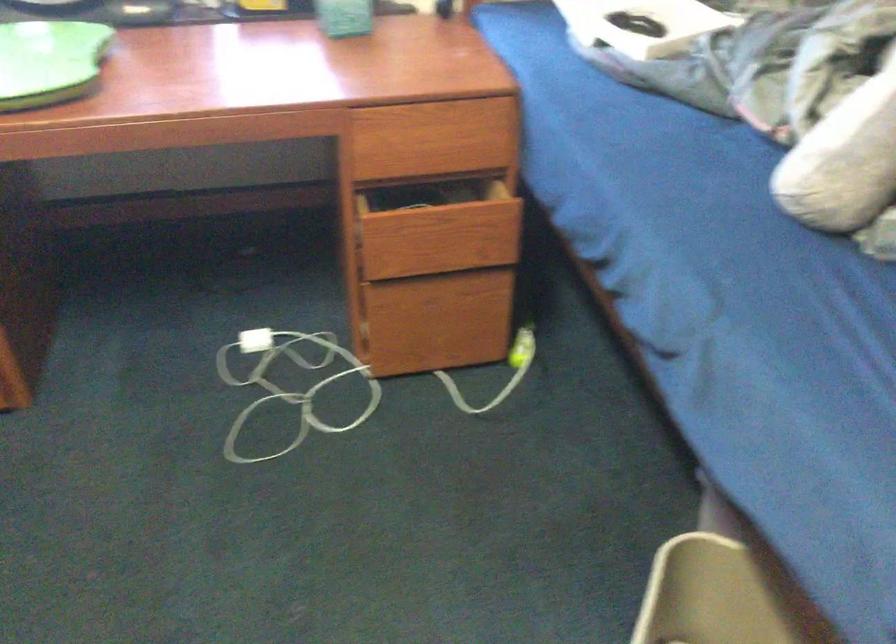
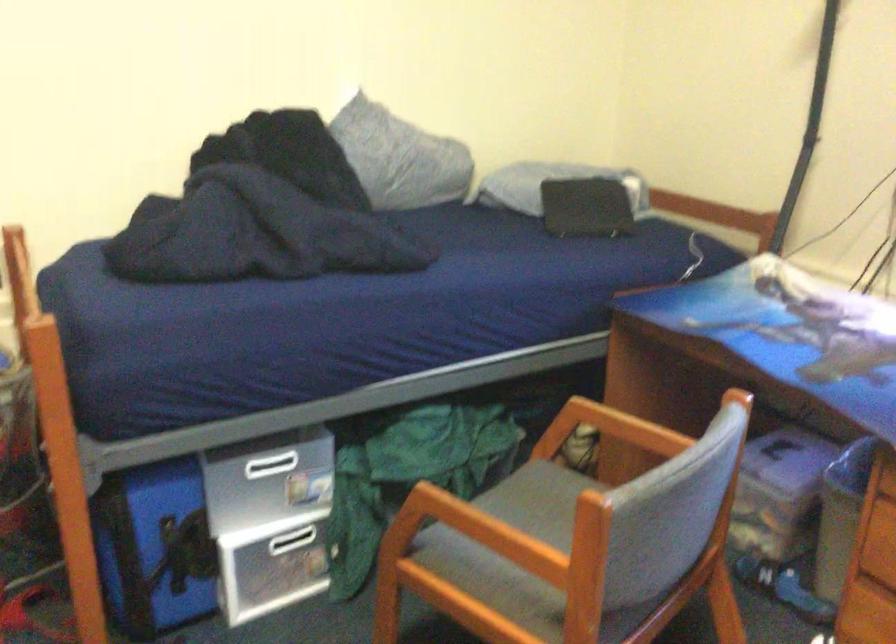
Question: Based on the continuous images, in which direction is the camera rotating? Reply with the corresponding letter.

Choices:
 (A) Left
 (B) Right
 (C) Up
 (D) Down

Answer: (A)